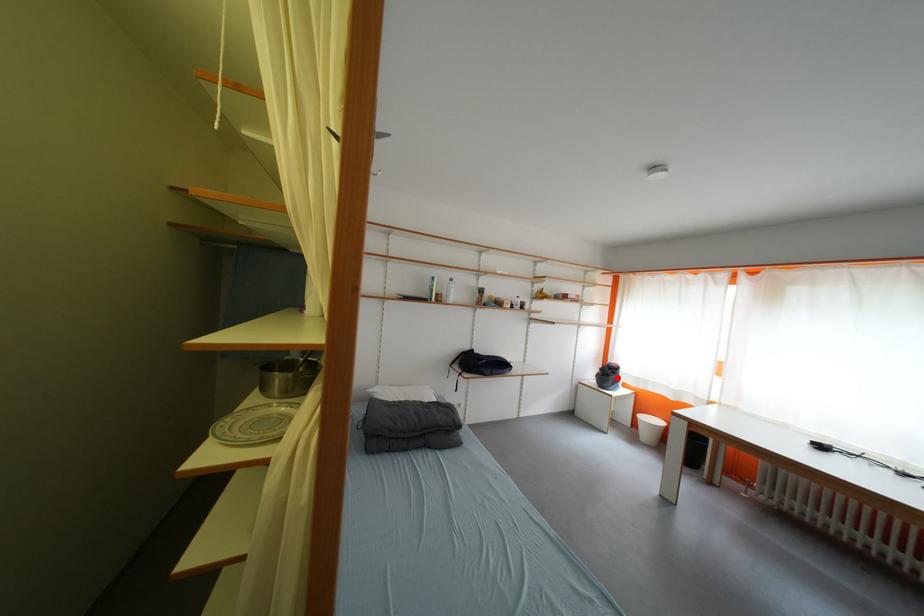
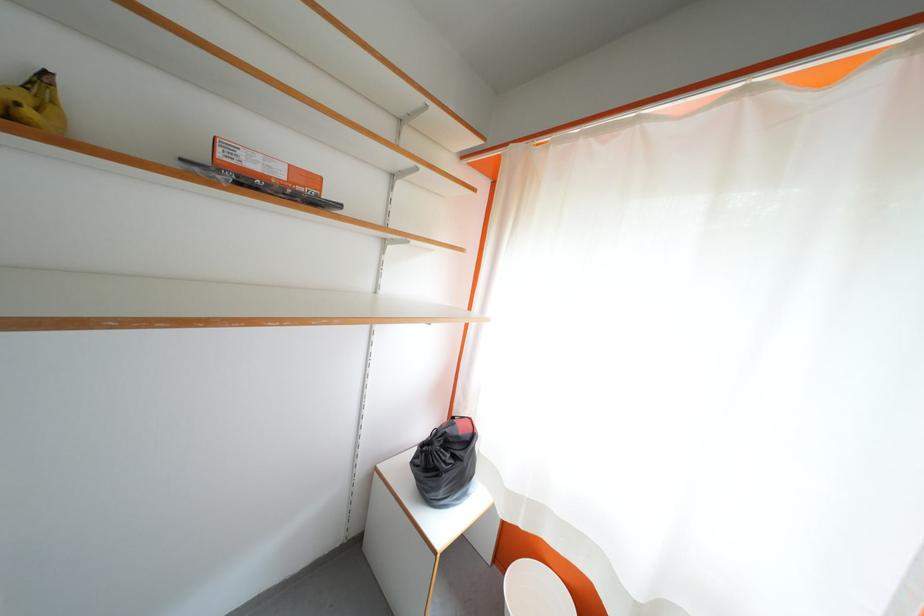
Question: I am providing you with two images of the same scene from different viewpoints. Image1 has a red point marked. In image2, the corresponding 3D location appears at what relative position? Reply with the corresponding letter.

Choices:
 (A) Closer
 (B) Farther

Answer: (B)